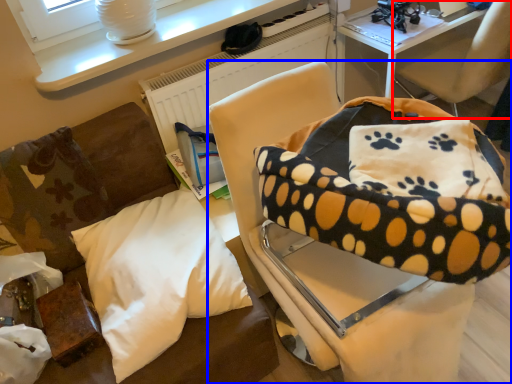
Question: Which object is further to the camera taking this photo, chair (highlighted by a red box) or chair (highlighted by a blue box)?

Choices:
 (A) chair
 (B) chair

Answer: (A)